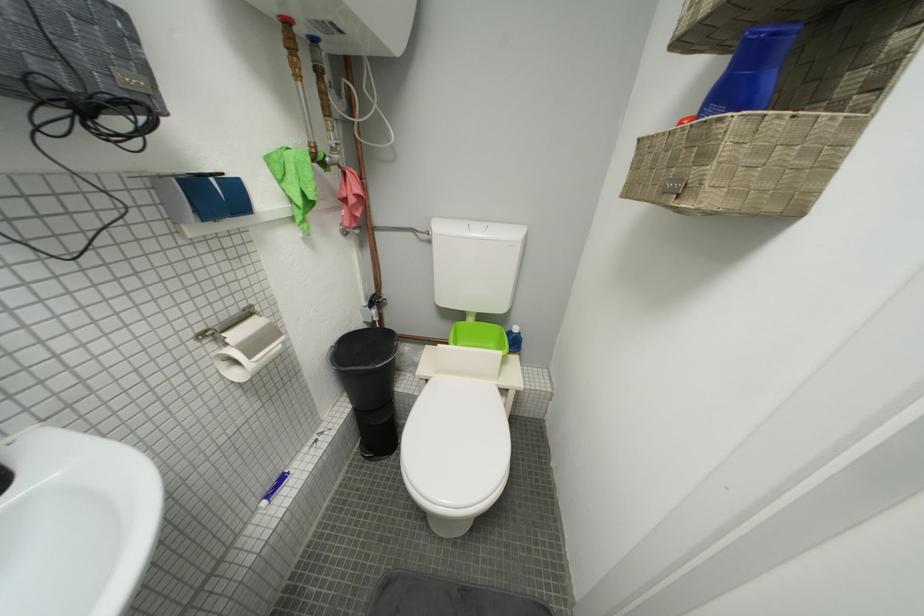
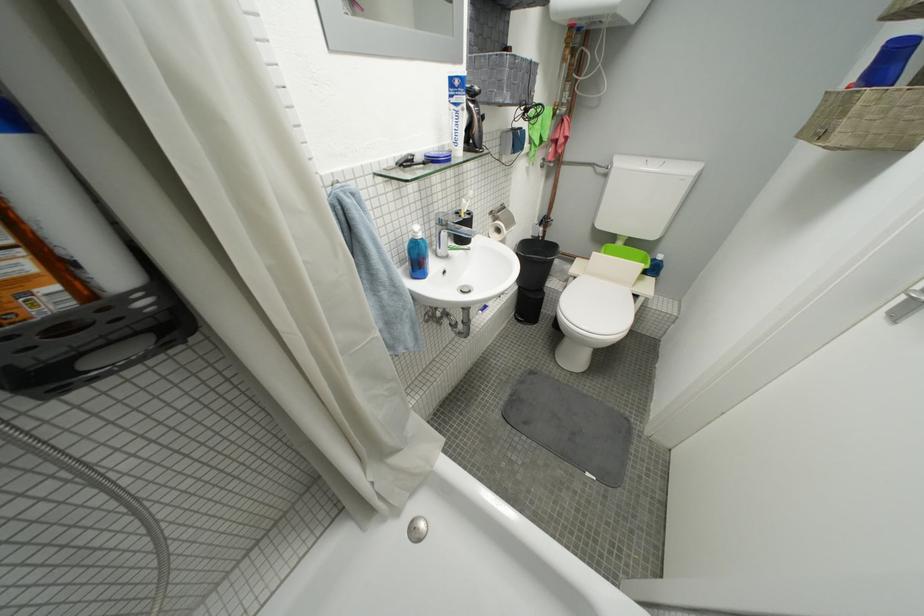
Where in the second image is the point corresponding to the point at 435,383 from the first image?

(584, 281)